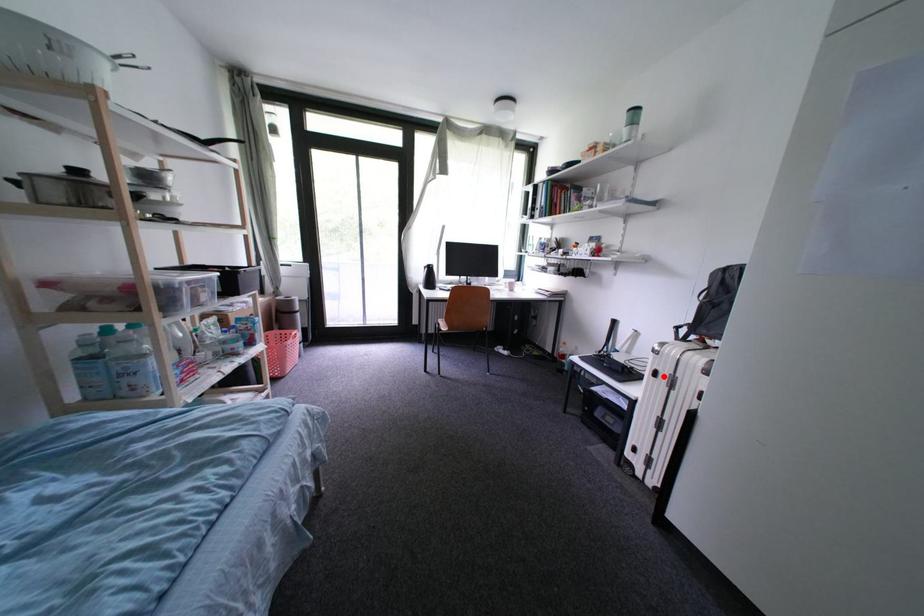
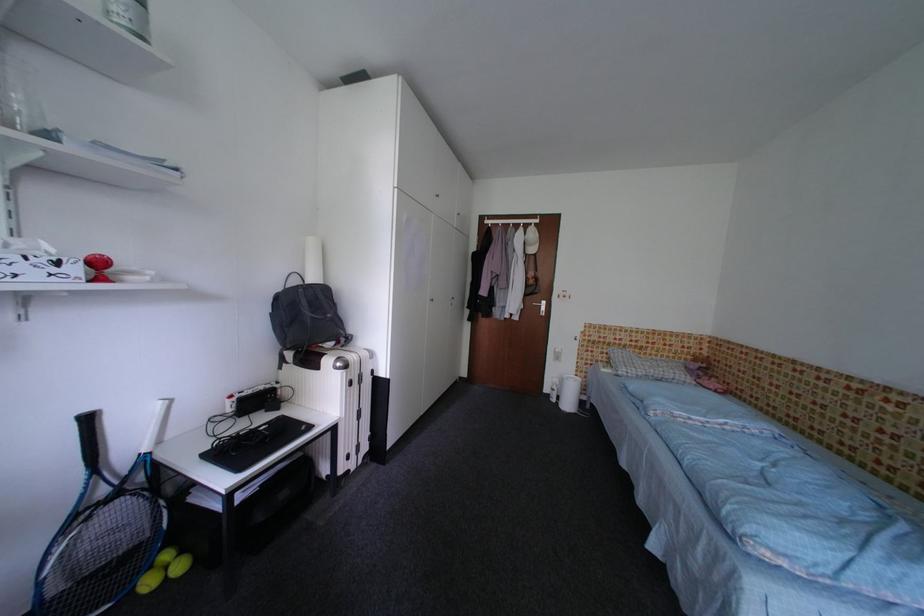
Find the pixel in the second image that matches the highlighted location in the first image.

(359, 386)